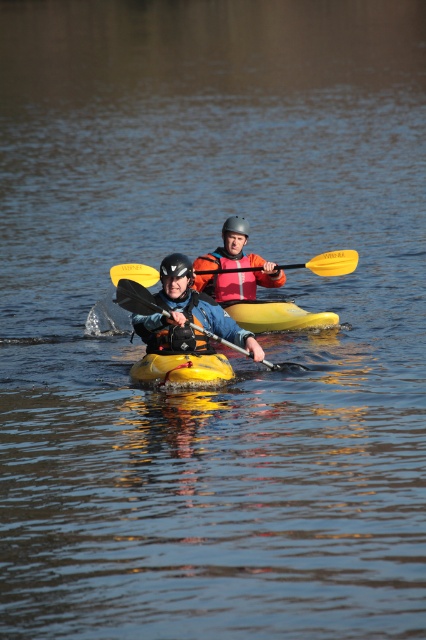
Question: Which point is farther from the camera taking this photo?

Choices:
 (A) (337, 252)
 (B) (276, 275)
 (C) (187, 376)

Answer: (B)

Question: Can you confirm if yellow foam paddle at center is smaller than yellow plastic paddle at center?

Choices:
 (A) yes
 (B) no

Answer: (A)

Question: Does orange life vest at center have a greater width compared to yellow matte canoe at center?

Choices:
 (A) yes
 (B) no

Answer: (A)

Question: Which of the following is the farthest from the observer?

Choices:
 (A) yellow matte canoe at center
 (B) orange life vest at center

Answer: (B)

Question: Which point is farther to the camera?

Choices:
 (A) (143, 291)
 (B) (166, 381)
 (C) (354, 260)

Answer: (C)

Question: Where is orange life vest at center located in relation to yellow matte canoe at center in the image?

Choices:
 (A) below
 (B) above

Answer: (B)